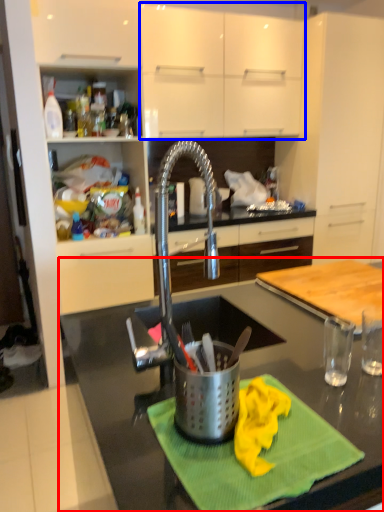
Question: Which point is further to the camera, countertop (highlighted by a red box) or cabinetry (highlighted by a blue box)?

Choices:
 (A) countertop
 (B) cabinetry

Answer: (B)